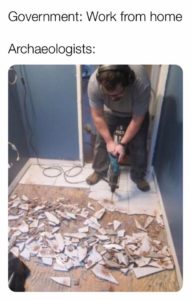
Where is `blue wall`? blue wall is located at coordinates (174, 189).